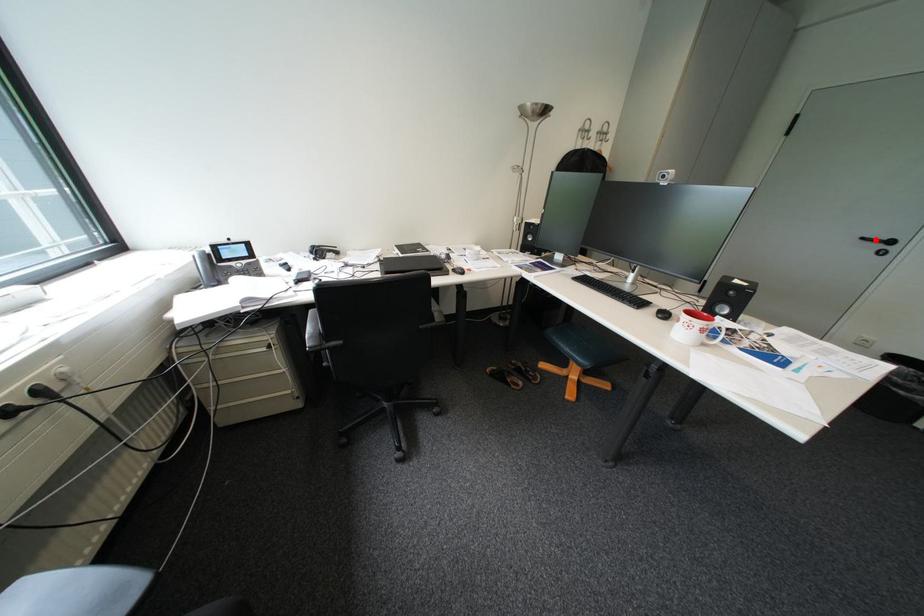
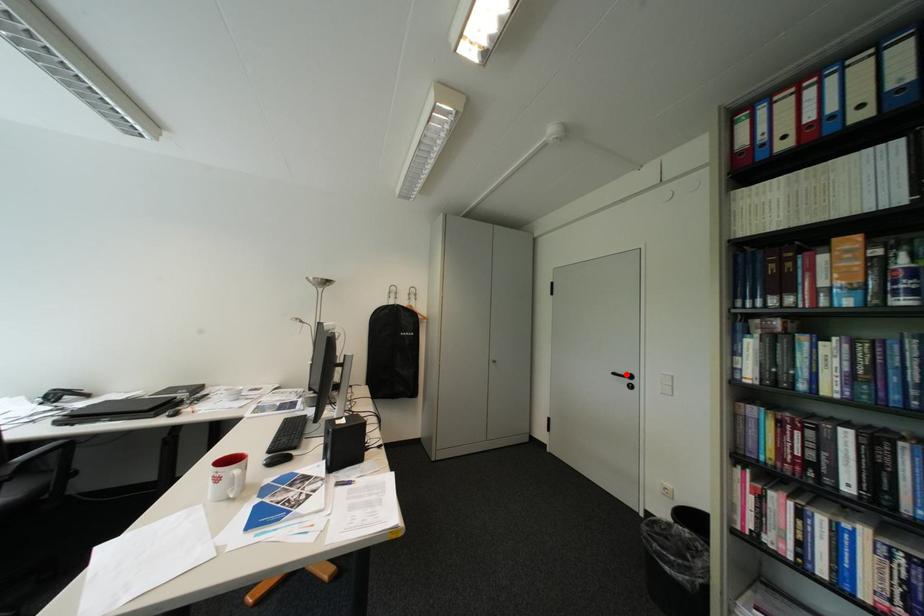
I am providing you with two images of the same scene from different viewpoints. A red point is marked on the first image and another point is marked on the second image. Does the point marked in image1 correspond to the same location as the one in image2?

Yes